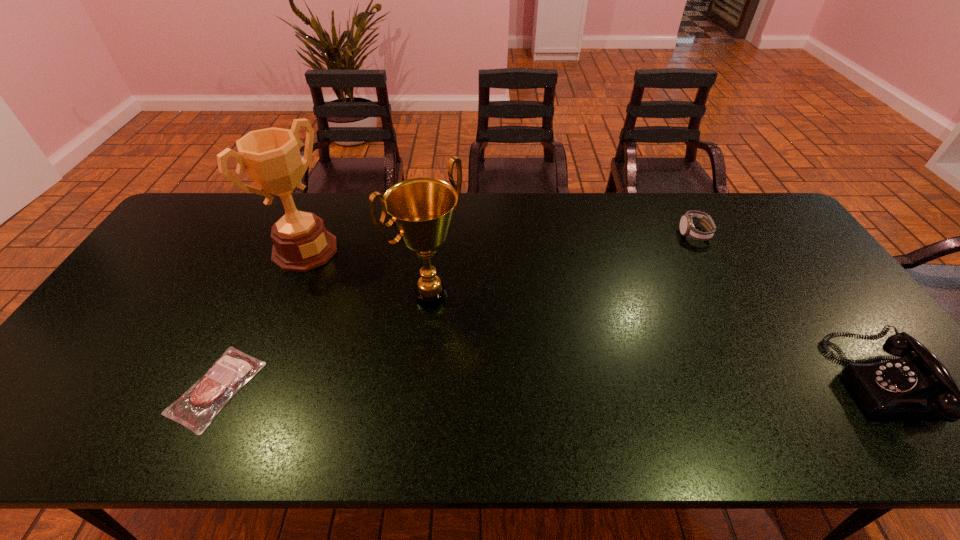
Where is `object that is the fourth nearest to the fourth object from left to right`? This screenshot has height=540, width=960. object that is the fourth nearest to the fourth object from left to right is located at coordinates (197, 407).

Point out which object is positioned as the second nearest to the rightmost object. Please provide its 2D coordinates. Your answer should be formatted as a tuple, i.e. [(x, y)], where the tuple contains the x and y coordinates of a point satisfying the conditions above.

[(421, 210)]

Where is `vacant region that satisfies the following two spatial constraints: 1. on the back side of the steak; 2. on the left side of the fourth object from left to right`? This screenshot has width=960, height=540. vacant region that satisfies the following two spatial constraints: 1. on the back side of the steak; 2. on the left side of the fourth object from left to right is located at coordinates (290, 234).